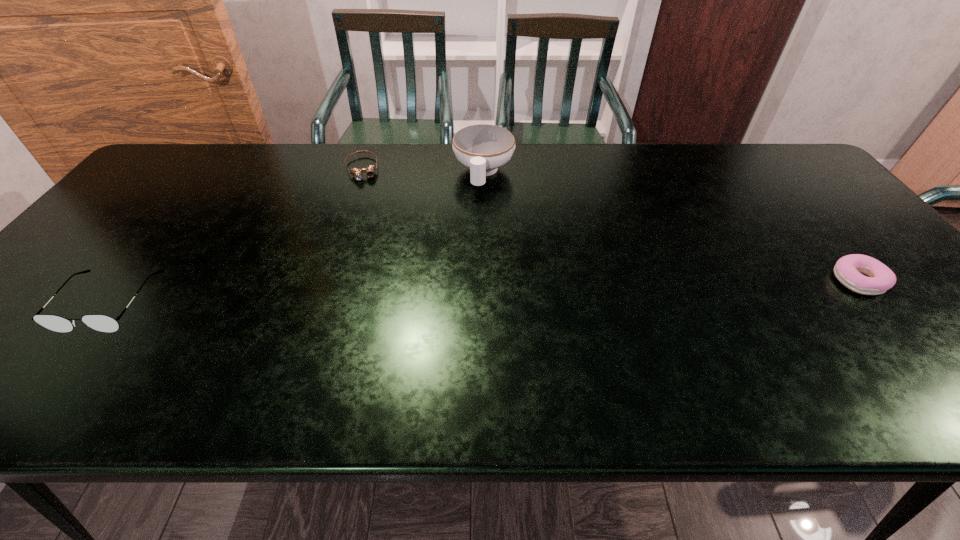
The image size is (960, 540). I want to click on the leftmost object, so click(x=103, y=323).

Locate an element on the screen. spectacles is located at coordinates (103, 323).

Locate an element on the screen. The height and width of the screenshot is (540, 960). the rightmost object is located at coordinates (848, 269).

The height and width of the screenshot is (540, 960). What are the coordinates of `pastry` in the screenshot? It's located at (848, 269).

Find the location of a particular element. chinaware is located at coordinates (483, 148).

Locate an element on the screen. This screenshot has width=960, height=540. the tallest object is located at coordinates (483, 148).

Where is `goggles`? The width and height of the screenshot is (960, 540). goggles is located at coordinates (357, 173).

In order to click on the shortest object in this screenshot , I will do `click(357, 173)`.

The image size is (960, 540). I want to click on vacant space located 0.050m on the lenses of the third shortest object, so click(x=71, y=353).

You are a GUI agent. You are given a task and a screenshot of the screen. Output one action in this format:
    pyautogui.click(x=<x>, y=<y>)
    Task: Click on the vacant space situated 0.220m on the left of the pastry
    
    Given the screenshot: What is the action you would take?
    pyautogui.click(x=741, y=280)